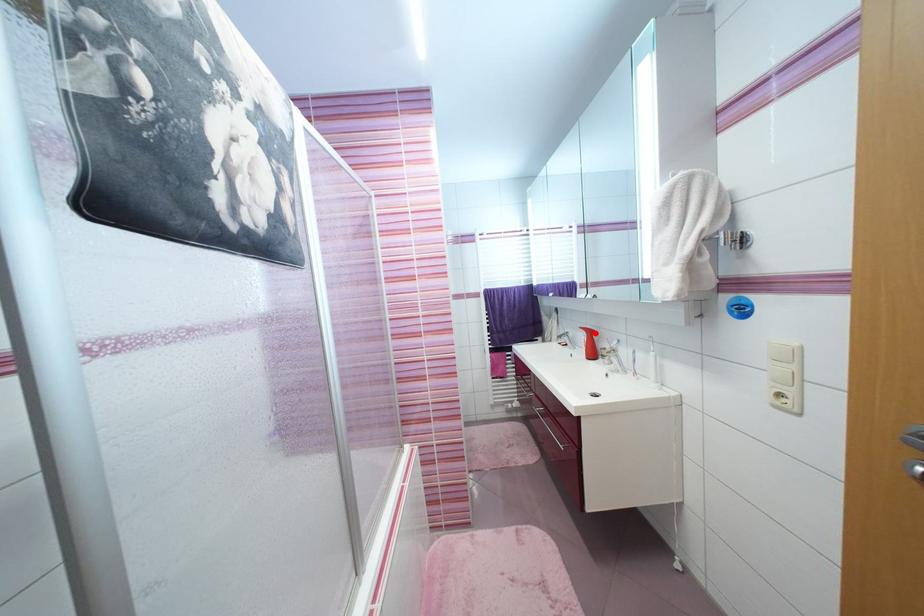
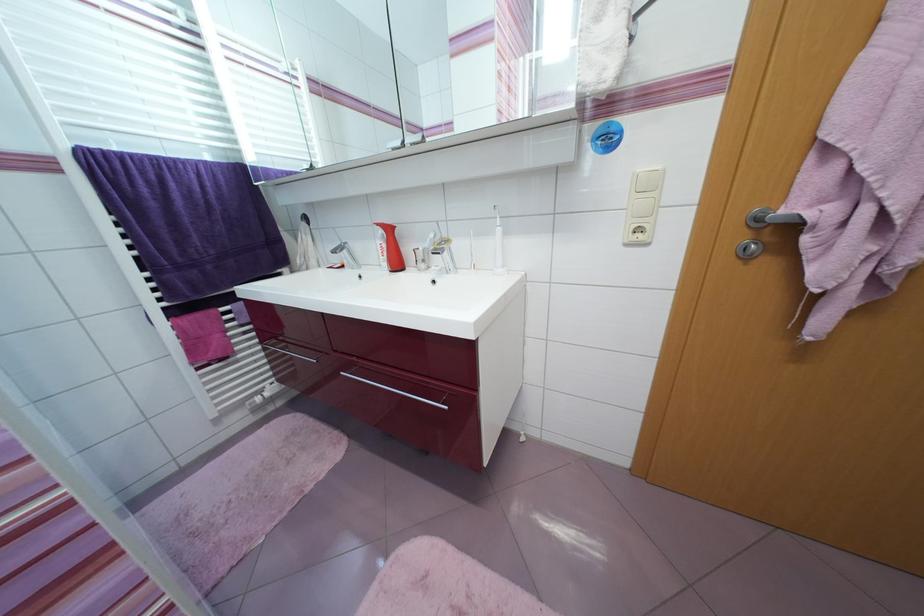
Where in the second image is the point corresponding to the highlighted location from the first image?

(394, 231)